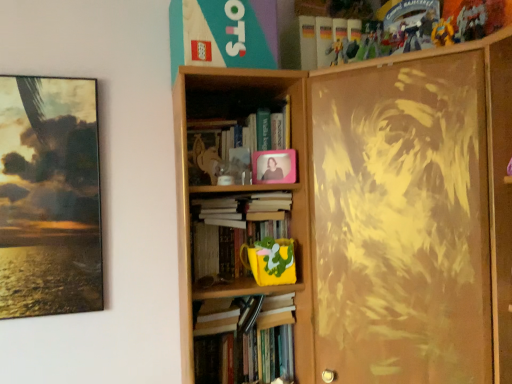
Question: Can you confirm if yellow matte mug at center, the second book positioned from the bottom, is shorter than yellow matte action figure at upper right?

Choices:
 (A) no
 (B) yes

Answer: (A)

Question: Is yellow matte mug at center, the second book from the top, to the right of yellow matte action figure at upper right from the viewer's perspective?

Choices:
 (A) no
 (B) yes

Answer: (A)

Question: Does yellow matte mug at center, the second book from the top, appear on the left side of yellow matte action figure at upper right?

Choices:
 (A) no
 (B) yes

Answer: (B)

Question: Is yellow matte mug at center, the second book positioned from the bottom, smaller than yellow matte action figure at upper right?

Choices:
 (A) yes
 (B) no

Answer: (B)

Question: Is yellow matte mug at center, the second book positioned from the bottom, positioned behind yellow matte action figure at upper right?

Choices:
 (A) yes
 (B) no

Answer: (A)

Question: Can yellow matte action figure at upper right be found inside yellow matte mug at center, the second book from the top?

Choices:
 (A) yes
 (B) no

Answer: (B)

Question: Considering the relative sizes of matte brown painting at right, arranged as the second bookcase when viewed from the left, and pink matte photo frame at upper center, which appears as the first book when viewed from the top, in the image provided, is matte brown painting at right, arranged as the second bookcase when viewed from the left, thinner than pink matte photo frame at upper center, which appears as the first book when viewed from the top,?

Choices:
 (A) no
 (B) yes

Answer: (A)

Question: Is matte brown painting at right, arranged as the second bookcase when viewed from the left, with pink matte photo frame at upper center, which appears as the first book when viewed from the top?

Choices:
 (A) no
 (B) yes

Answer: (A)

Question: Does matte brown painting at right, arranged as the second bookcase when viewed from the left, have a greater height compared to pink matte photo frame at upper center, which appears as the first book when viewed from the top?

Choices:
 (A) yes
 (B) no

Answer: (A)

Question: Is matte brown painting at right, the 1th bookcase viewed from the right, wider than pink matte photo frame at upper center, which appears as the first book when viewed from the top?

Choices:
 (A) no
 (B) yes

Answer: (B)

Question: Does matte brown painting at right, arranged as the second bookcase when viewed from the left, have a smaller size compared to pink matte photo frame at upper center, placed as the third book when sorted from bottom to top?

Choices:
 (A) no
 (B) yes

Answer: (A)

Question: Can you confirm if matte brown painting at right, the 1th bookcase viewed from the right, is positioned to the left of pink matte photo frame at upper center, which appears as the first book when viewed from the top?

Choices:
 (A) no
 (B) yes

Answer: (A)

Question: Considering the relative sizes of matte paper book at upper center and wooden bookcase at center, which is the 2th bookcase in right-to-left order, in the image provided, is matte paper book at upper center taller than wooden bookcase at center, which is the 2th bookcase in right-to-left order,?

Choices:
 (A) yes
 (B) no

Answer: (B)